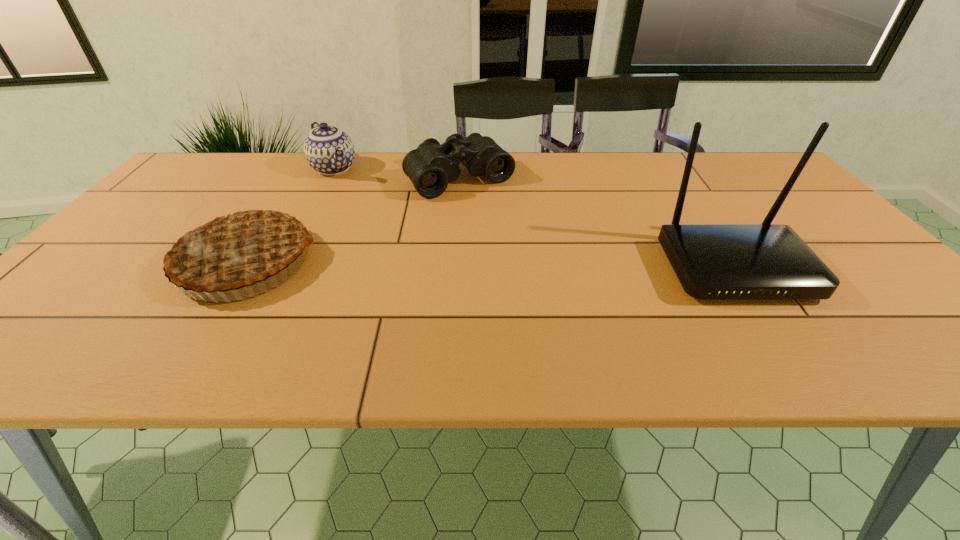
In the image, there is a desktop. Identify the location of vacant space at the left edge. (177, 219).

The height and width of the screenshot is (540, 960). I want to click on free space at the far right corner of the desktop, so click(750, 154).

Locate an element on the screen. empty space that is in between the second tallest object and the rightmost object is located at coordinates (491, 265).

Where is `vacant area between the router and the second shortest object`? Image resolution: width=960 pixels, height=540 pixels. vacant area between the router and the second shortest object is located at coordinates (534, 218).

Locate an element on the screen. The height and width of the screenshot is (540, 960). vacant area that lies between the chinaware and the shortest object is located at coordinates (396, 173).

Where is `free space between the chinaware and the shortest object`? This screenshot has height=540, width=960. free space between the chinaware and the shortest object is located at coordinates (396, 173).

I want to click on vacant space that is in between the tallest object and the third tallest object, so click(x=534, y=218).

Locate an element on the screen. The image size is (960, 540). vacant area between the router and the second shortest object is located at coordinates (534, 218).

The height and width of the screenshot is (540, 960). Identify the location of free space between the second shortest object and the router. (534, 218).

Choose which object is the second nearest neighbor to the second object from right to left. Please provide its 2D coordinates. Your answer should be formatted as a tuple, i.e. [(x, y)], where the tuple contains the x and y coordinates of a point satisfying the conditions above.

[(234, 245)]